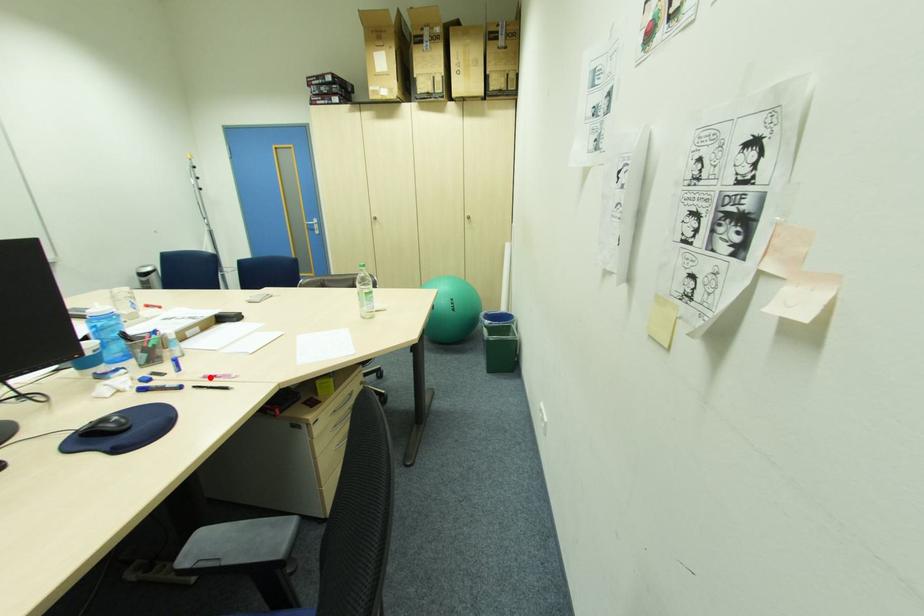
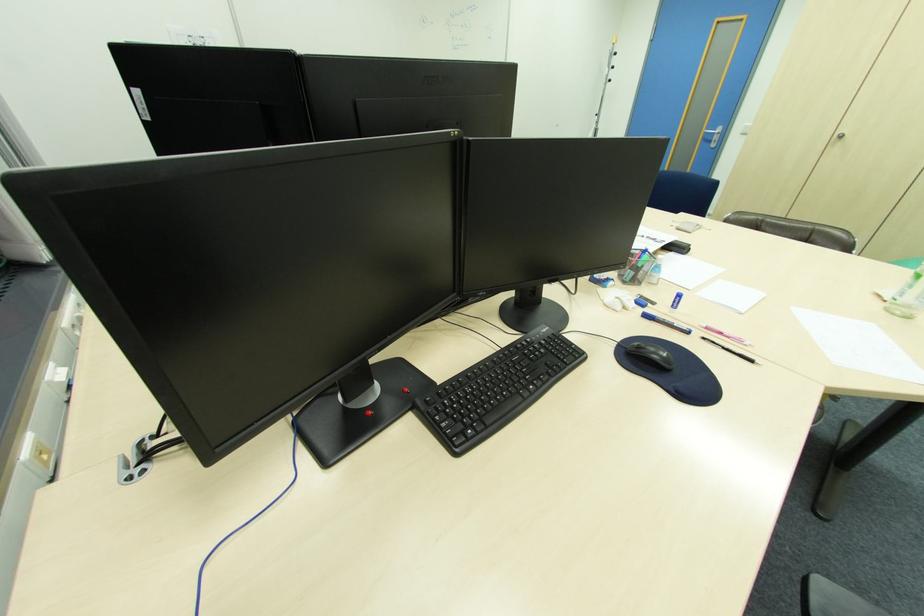
In the second image, find the point that corresponds to the highlighted location in the first image.

(712, 328)